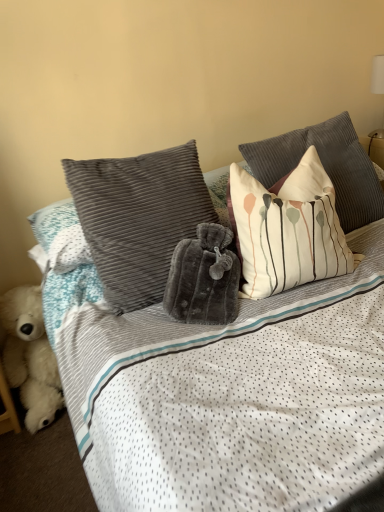
Question: Does white cotton pillow with abstract design at upper right, which is the 1th pillow from right to left, have a lesser width compared to velvety gray pillow at center, placed as the 3th pillow when sorted from right to left?

Choices:
 (A) no
 (B) yes

Answer: (A)

Question: Is white cotton pillow with abstract design at upper right, which is the 1th pillow from right to left, positioned in front of velvety gray pillow at center, placed as the 3th pillow when sorted from right to left?

Choices:
 (A) yes
 (B) no

Answer: (B)

Question: Is white cotton pillow with abstract design at upper right, which is the 1th pillow from right to left, to the right of velvety gray pillow at center, placed as the 3th pillow when sorted from right to left, from the viewer's perspective?

Choices:
 (A) yes
 (B) no

Answer: (A)

Question: From a real-world perspective, is white cotton pillow with abstract design at upper right, positioned as the third pillow in left-to-right order, physically below velvety gray pillow at center, placed as the 3th pillow when sorted from right to left?

Choices:
 (A) no
 (B) yes

Answer: (B)

Question: Is white cotton pillow with abstract design at upper right, which is the 1th pillow from right to left, taller than velvety gray pillow at center, placed as the 3th pillow when sorted from right to left?

Choices:
 (A) no
 (B) yes

Answer: (A)

Question: Is velvety gray pillow at center, placed as the 3th pillow when sorted from right to left, completely or partially inside white cotton pillow with abstract design at upper right, which is the 1th pillow from right to left?

Choices:
 (A) yes
 (B) no

Answer: (B)

Question: Does white striped pillow at upper right, which is counted as the 2th pillow, starting from the right, appear on the left side of velvety gray pillow at center, placed as the 3th pillow when sorted from right to left?

Choices:
 (A) no
 (B) yes

Answer: (A)

Question: Is white striped pillow at upper right, which is counted as the 2th pillow, starting from the right, bigger than velvety gray pillow at center, which appears as the first pillow when viewed from the left?

Choices:
 (A) no
 (B) yes

Answer: (A)

Question: Is the surface of white striped pillow at upper right, marked as the 2th pillow in a left-to-right arrangement, in direct contact with velvety gray pillow at center, which appears as the first pillow when viewed from the left?

Choices:
 (A) yes
 (B) no

Answer: (B)

Question: Is white striped pillow at upper right, marked as the 2th pillow in a left-to-right arrangement, shorter than velvety gray pillow at center, which appears as the first pillow when viewed from the left?

Choices:
 (A) yes
 (B) no

Answer: (A)

Question: Can you confirm if white striped pillow at upper right, marked as the 2th pillow in a left-to-right arrangement, is thinner than velvety gray pillow at center, which appears as the first pillow when viewed from the left?

Choices:
 (A) yes
 (B) no

Answer: (B)

Question: Can you confirm if white striped pillow at upper right, which is counted as the 2th pillow, starting from the right, is smaller than velvety gray pillow at center, which appears as the first pillow when viewed from the left?

Choices:
 (A) no
 (B) yes

Answer: (B)

Question: Can you confirm if white fluffy teddy bear at lower left is taller than white striped pillow at upper right, marked as the 2th pillow in a left-to-right arrangement?

Choices:
 (A) yes
 (B) no

Answer: (B)